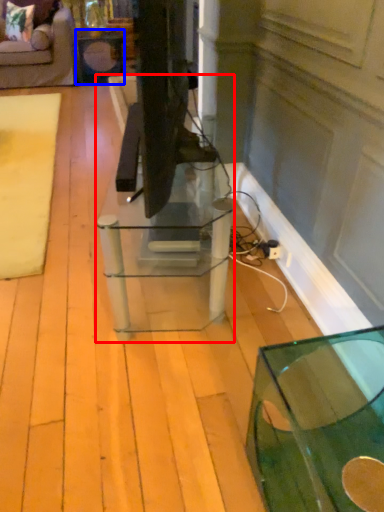
Question: Which of the following is the closest to the observer, table (highlighted by a red box) or side table (highlighted by a blue box)?

Choices:
 (A) table
 (B) side table

Answer: (A)